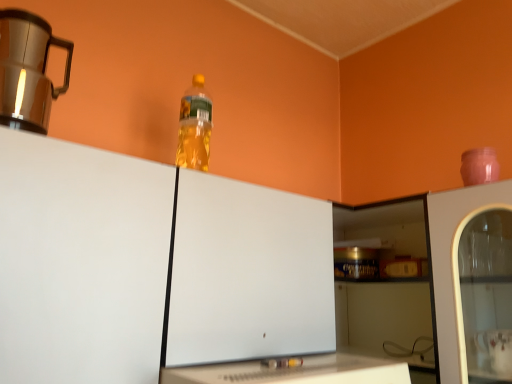
Question: From the image's perspective, is transparent plastic bottle at upper center on top of translucent plastic bottle at upper center?

Choices:
 (A) no
 (B) yes

Answer: (A)

Question: Can you confirm if transparent plastic bottle at upper center is wider than translucent plastic bottle at upper center?

Choices:
 (A) no
 (B) yes

Answer: (B)

Question: Are transparent plastic bottle at upper center and translucent plastic bottle at upper center located far from each other?

Choices:
 (A) no
 (B) yes

Answer: (A)

Question: From the image's perspective, would you say transparent plastic bottle at upper center is shown under translucent plastic bottle at upper center?

Choices:
 (A) yes
 (B) no

Answer: (A)

Question: Is transparent plastic bottle at upper center surrounding translucent plastic bottle at upper center?

Choices:
 (A) no
 (B) yes

Answer: (A)

Question: From a real-world perspective, is transparent plastic bottle at upper center under translucent plastic bottle at upper center?

Choices:
 (A) yes
 (B) no

Answer: (A)

Question: Can you confirm if transparent plastic bottle at upper center is positioned to the right of brushed metal mug at upper left?

Choices:
 (A) yes
 (B) no

Answer: (A)

Question: Is transparent plastic bottle at upper center not near brushed metal mug at upper left?

Choices:
 (A) no
 (B) yes

Answer: (A)

Question: From the image's perspective, would you say transparent plastic bottle at upper center is shown under brushed metal mug at upper left?

Choices:
 (A) yes
 (B) no

Answer: (A)

Question: Does transparent plastic bottle at upper center lie behind brushed metal mug at upper left?

Choices:
 (A) yes
 (B) no

Answer: (B)

Question: From the image's perspective, does transparent plastic bottle at upper center appear higher than brushed metal mug at upper left?

Choices:
 (A) yes
 (B) no

Answer: (B)

Question: Is transparent plastic bottle at upper center wider than brushed metal mug at upper left?

Choices:
 (A) yes
 (B) no

Answer: (A)

Question: Is brushed metal mug at upper left to the left of translucent plastic bottle at upper center from the viewer's perspective?

Choices:
 (A) yes
 (B) no

Answer: (A)